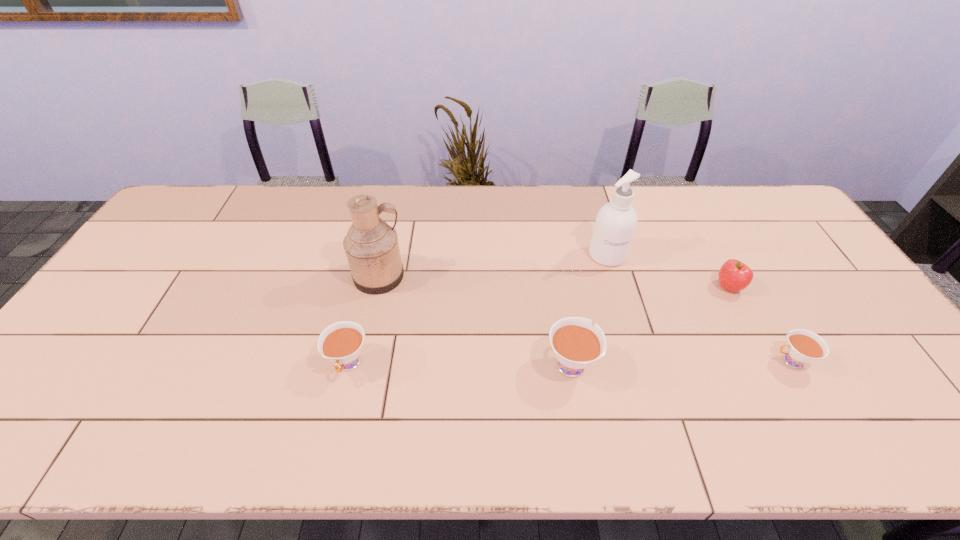
Where is `teacup that stands as the closest to the second teacup from right to left`? teacup that stands as the closest to the second teacup from right to left is located at coordinates (341, 342).

Image resolution: width=960 pixels, height=540 pixels. I want to click on the closest teacup to the third object from right to left, so click(x=576, y=344).